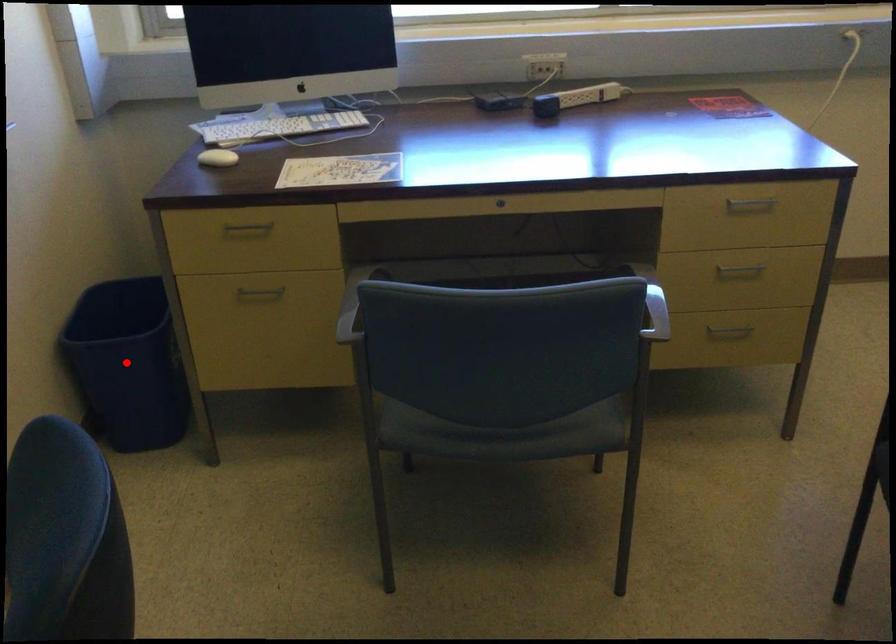
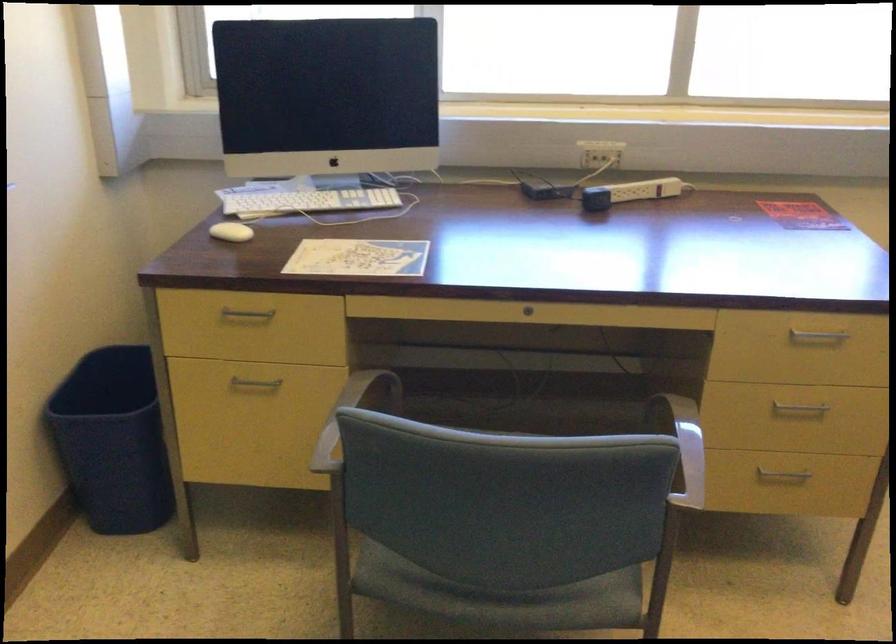
In the second image, find the point that corresponds to the highlighted location in the first image.

(113, 440)